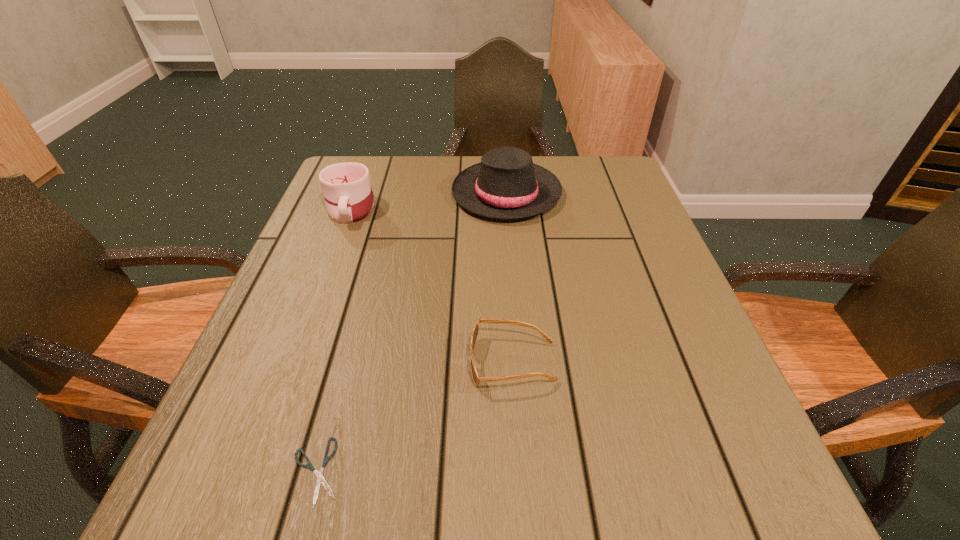
What are the coordinates of `vacant space located 0.200m on the front-facing side of the third farthest object` in the screenshot? It's located at (354, 362).

At what (x,y) coordinates should I click in order to perform the action: click on free space located on the back of the shortest object. Please return your answer as a coordinate pair (x, y). This screenshot has width=960, height=540. Looking at the image, I should click on point(368,278).

Image resolution: width=960 pixels, height=540 pixels. Find the location of `dress hat at the far edge`. dress hat at the far edge is located at coordinates (506, 184).

Find the location of a particular element. mug that is positioned at the far edge is located at coordinates (348, 194).

You are a GUI agent. You are given a task and a screenshot of the screen. Output one action in this format:
    pyautogui.click(x=<x>, y=<y>)
    Task: Click on the object that is at the near edge
    
    Given the screenshot: What is the action you would take?
    320,479

In order to click on mug at the left edge in this screenshot , I will do `click(348, 194)`.

Where is `shears at the left edge`? The height and width of the screenshot is (540, 960). shears at the left edge is located at coordinates (320, 479).

Identify the location of object positioned at the far left corner. Image resolution: width=960 pixels, height=540 pixels. (348, 194).

The height and width of the screenshot is (540, 960). Identify the location of object that is positioned at the near left corner. (320, 479).

Identify the location of blank space at the far edge of the desktop. (544, 155).